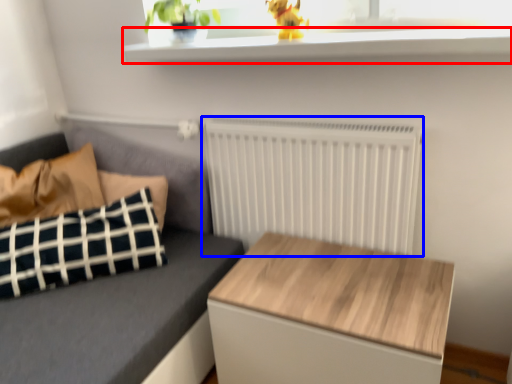
Question: Among these objects, which one is nearest to the camera, window sill (highlighted by a red box) or radiator (highlighted by a blue box)?

Choices:
 (A) window sill
 (B) radiator

Answer: (A)